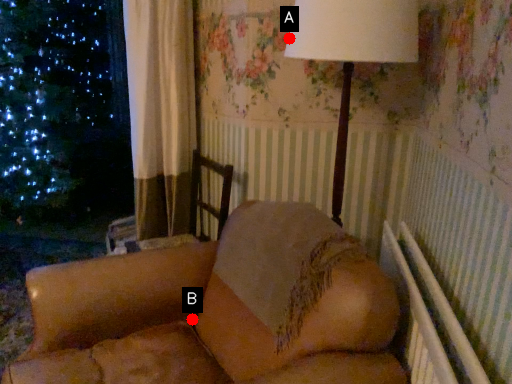
Question: Two points are circled on the image, labeled by A and B beside each circle. Among these points, which one is farthest from the camera?

Choices:
 (A) A is further
 (B) B is further

Answer: (B)